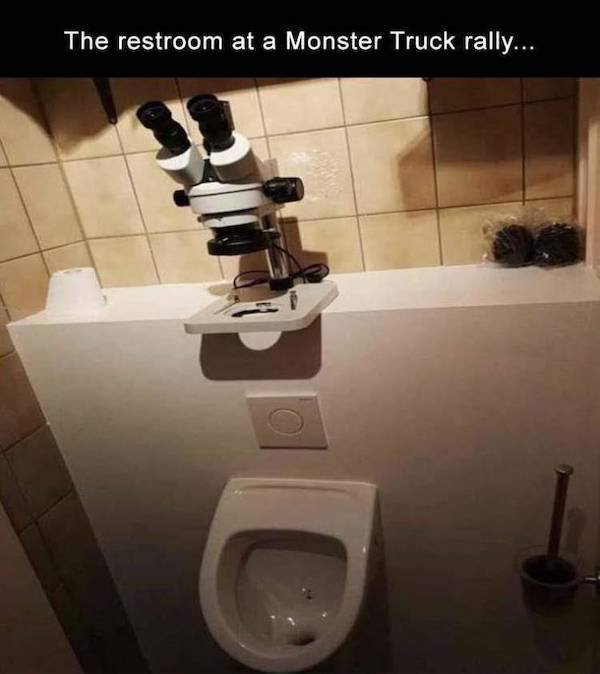
Identify the location of tile. (112, 211).